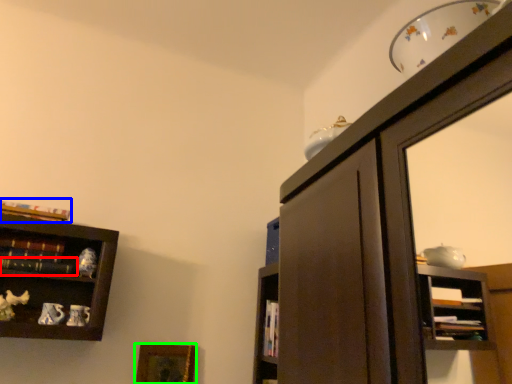
Question: Which is nearer to the book (highlighted by a red box)? book (highlighted by a blue box) or picture frame (highlighted by a green box).

Choices:
 (A) book
 (B) picture frame

Answer: (A)